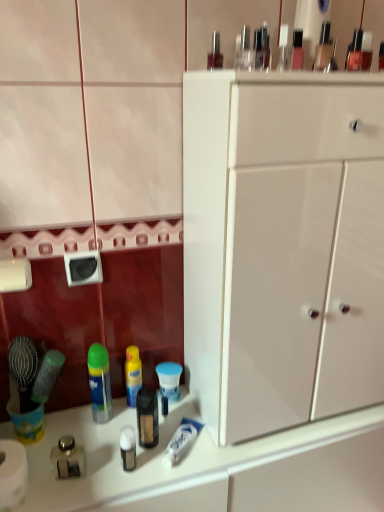
Question: Can we say white glossy cabinet at center lies outside white glossy counter top at lower left?

Choices:
 (A) yes
 (B) no

Answer: (A)

Question: From the image's perspective, does white glossy cabinet at center appear higher than white glossy counter top at lower left?

Choices:
 (A) yes
 (B) no

Answer: (A)

Question: From the image's perspective, is white glossy cabinet at center beneath white glossy counter top at lower left?

Choices:
 (A) yes
 (B) no

Answer: (B)

Question: Is white glossy cabinet at center closer to camera compared to white glossy counter top at lower left?

Choices:
 (A) no
 (B) yes

Answer: (B)

Question: Is white glossy cabinet at center facing towards white glossy counter top at lower left?

Choices:
 (A) yes
 (B) no

Answer: (B)

Question: Is point (165, 362) closer or farther from the camera than point (97, 415)?

Choices:
 (A) closer
 (B) farther

Answer: (B)

Question: From the image's perspective, is blue matte toothpaste tube at lower center, which is the second toiletry in front-to-back order, located above or below green plastic mouthwash at center?

Choices:
 (A) below
 (B) above

Answer: (A)

Question: Which is correct: blue matte toothpaste tube at lower center, acting as the 1th toiletry starting from the top, is inside green plastic mouthwash at center, or outside of it?

Choices:
 (A) inside
 (B) outside

Answer: (B)

Question: Looking at the image, does blue matte toothpaste tube at lower center, which is the second toiletry in front-to-back order, seem bigger or smaller compared to green plastic mouthwash at center?

Choices:
 (A) small
 (B) big

Answer: (A)

Question: From a real-world perspective, is blue matte toothpaste tube at lower center, acting as the first toiletry starting from the right, positioned above or below clear glass jar at lower left, the 2th toiletry from the back?

Choices:
 (A) above
 (B) below

Answer: (A)

Question: From the image's perspective, relative to clear glass jar at lower left, which is the 1th toiletry in left-to-right order, is blue matte toothpaste tube at lower center, which ranks as the 1th toiletry in back-to-front order, above or below?

Choices:
 (A) above
 (B) below

Answer: (A)

Question: Based on their sizes in the image, would you say blue matte toothpaste tube at lower center, which ranks as the 1th toiletry in back-to-front order, is bigger or smaller than clear glass jar at lower left, the 2th toiletry from the back?

Choices:
 (A) small
 (B) big

Answer: (B)

Question: In terms of height, does blue matte toothpaste tube at lower center, acting as the second toiletry starting from the bottom, look taller or shorter compared to clear glass jar at lower left, the first toiletry positioned from the front?

Choices:
 (A) tall
 (B) short

Answer: (A)

Question: Do you think white matte toilet paper at lower left is within white glossy counter top at lower left, or outside of it?

Choices:
 (A) outside
 (B) inside

Answer: (A)

Question: Is white matte toilet paper at lower left to the left or to the right of white glossy counter top at lower left in the image?

Choices:
 (A) left
 (B) right

Answer: (A)